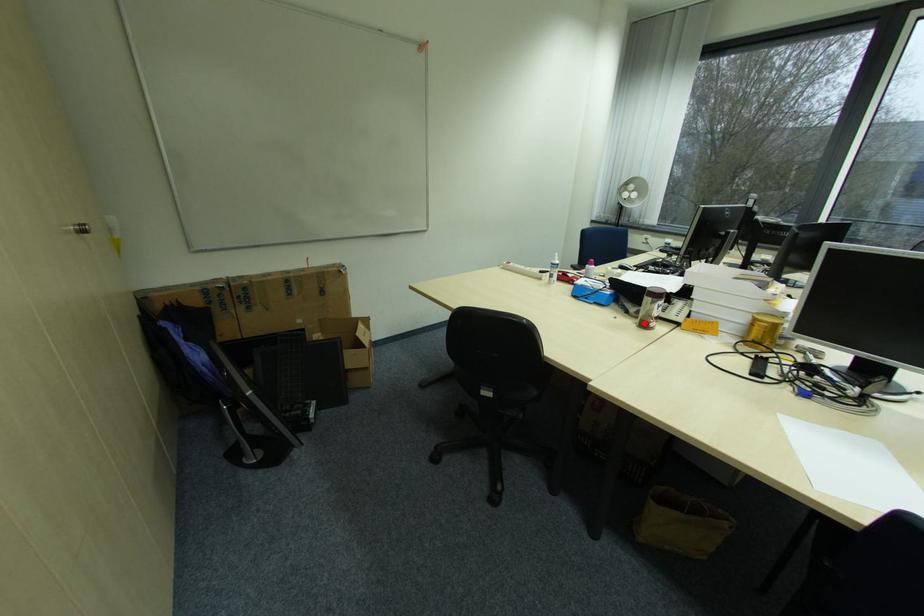
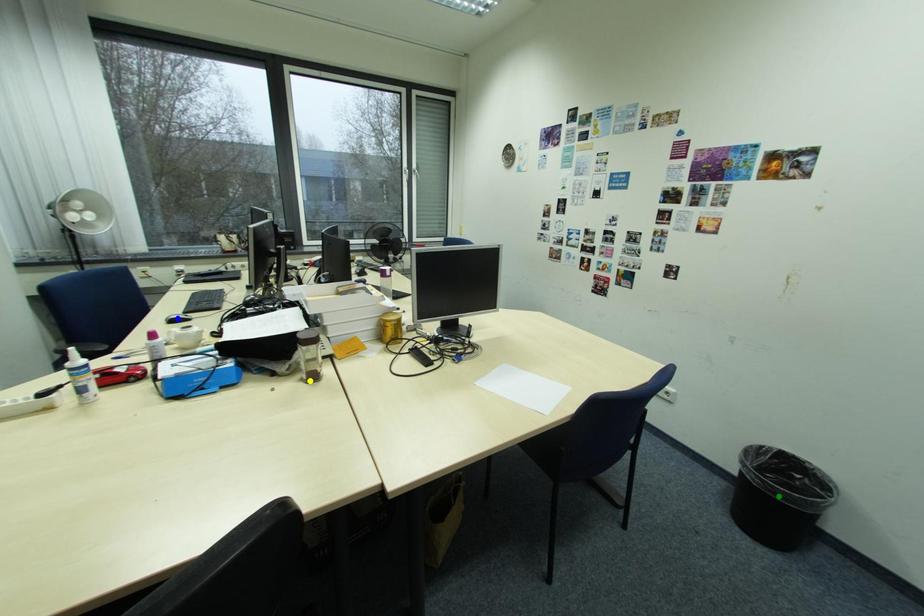
Question: I am providing you with two images of the same scene from different viewpoints. A red point is marked on the first image. You are given multiple points on the second image. Which spot in image 2 lines up with the point in image 1?

Choices:
 (A) green point
 (B) blue point
 (C) yellow point

Answer: (C)